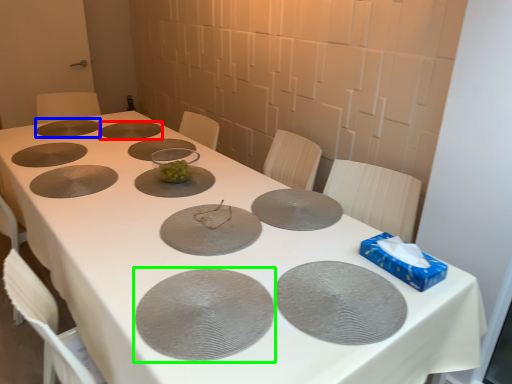
Question: Considering the real-world distances, which object is farthest from glass plate (highlighted by a red box)? glass plate (highlighted by a blue box) or glass plate (highlighted by a green box)?

Choices:
 (A) glass plate
 (B) glass plate

Answer: (B)